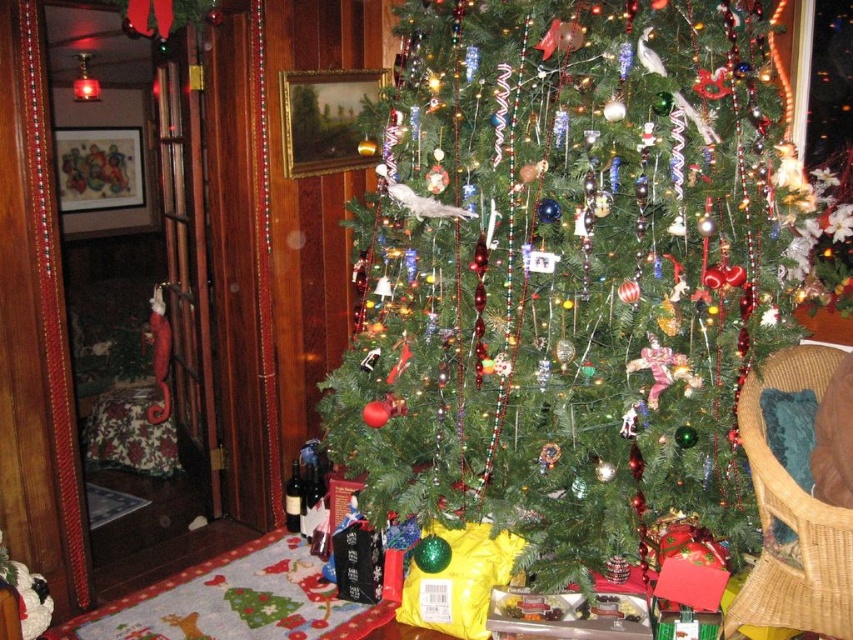
You are organizing a Christmas party and need to place a new decoration between the woven wicker chair at lower right and the matte glass wine bottle at lower left. Based on their positions, which side of the wine bottle should you place the decoration on?

The woven wicker chair at lower right is positioned on the right side of the matte glass wine bottle at lower left, so you should place the decoration to the right of the wine bottle.